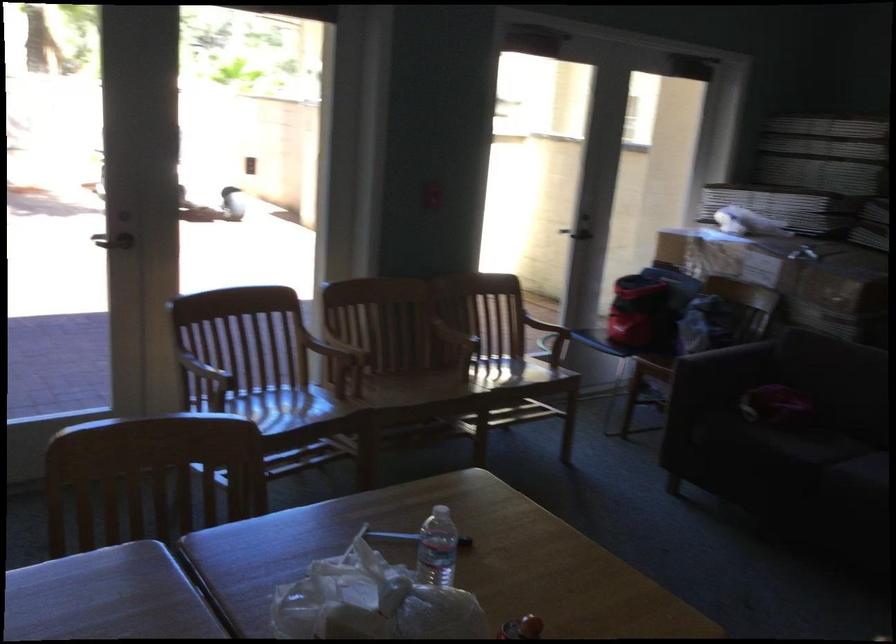
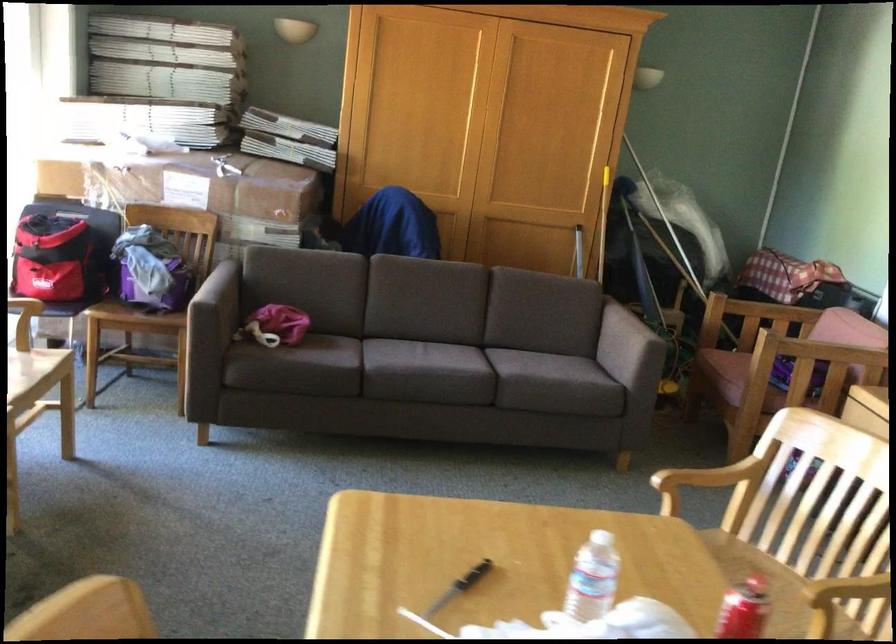
Locate, in the second image, the point that corresponds to point (641, 314) in the first image.

(74, 279)